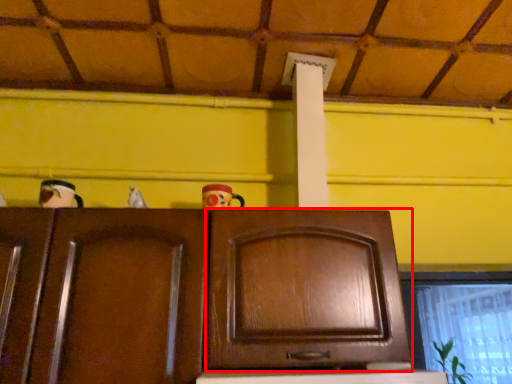
Question: From the image's perspective, considering the relative positions of cabinetry (annotated by the red box) and window in the image provided, where is cabinetry (annotated by the red box) located with respect to the staircase?

Choices:
 (A) above
 (B) below

Answer: (A)